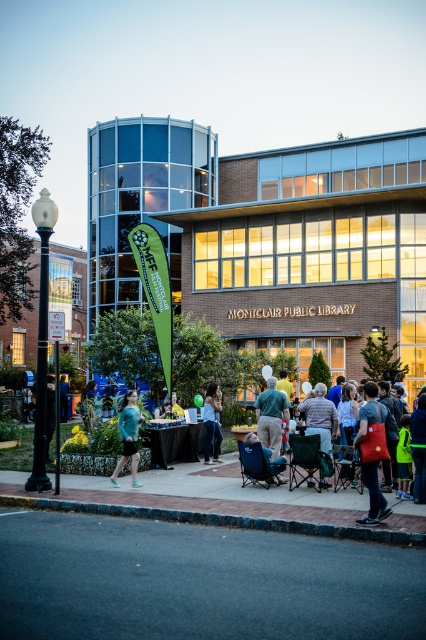
In the scene shown: Is teal fabric shirt at center shorter than denim jacket at center?

Yes, teal fabric shirt at center is shorter than denim jacket at center.

Can you confirm if teal fabric shirt at center is taller than denim jacket at center?

No.

Does point (127, 404) come farther from viewer compared to point (209, 458)?

No, it is in front of (209, 458).

In order to click on teal fabric shirt at center in this screenshot , I will do `click(129, 435)`.

Is teal fabric shirt at center to the left of blue fabric chair at center from the viewer's perspective?

Yes, teal fabric shirt at center is to the left of blue fabric chair at center.

Can you confirm if teal fabric shirt at center is bigger than blue fabric chair at center?

Indeed, teal fabric shirt at center has a larger size compared to blue fabric chair at center.

Does point (117, 467) come closer to viewer compared to point (267, 452)?

No, it is behind (267, 452).

At what (x,y) coordinates should I click in order to perform the action: click on teal fabric shirt at center. Please return your answer as a coordinate pair (x, y). The image size is (426, 640). Looking at the image, I should click on (129, 435).

Can you confirm if red fabric bag at center is thinner than black tablecloth at center?

Correct, red fabric bag at center's width is less than black tablecloth at center's.

Is red fabric bag at center below black tablecloth at center?

Incorrect, red fabric bag at center is not positioned below black tablecloth at center.

Is point (371, 486) positioned behind point (195, 428)?

No, it is not.

Locate an element on the screen. This screenshot has width=426, height=640. red fabric bag at center is located at coordinates (371, 417).